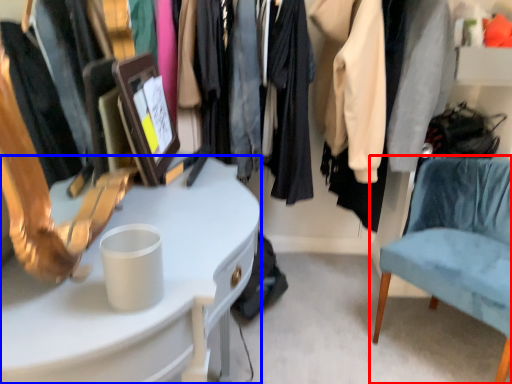
Question: Among these objects, which one is nearest to the camera, chair (highlighted by a red box) or desk (highlighted by a blue box)?

Choices:
 (A) chair
 (B) desk

Answer: (B)